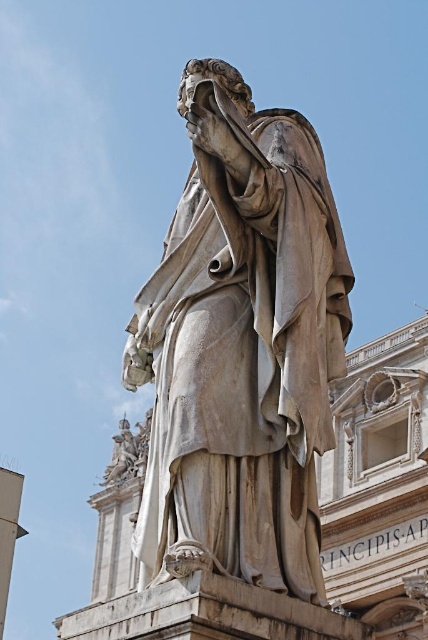
Is white marble statue at center below white marble statue at lower left?

No, white marble statue at center is not below white marble statue at lower left.

Is point (228, 148) behind point (122, 464)?

No, (228, 148) is in front of (122, 464).

What are the coordinates of `white marble statue at center` in the screenshot? It's located at (240, 346).